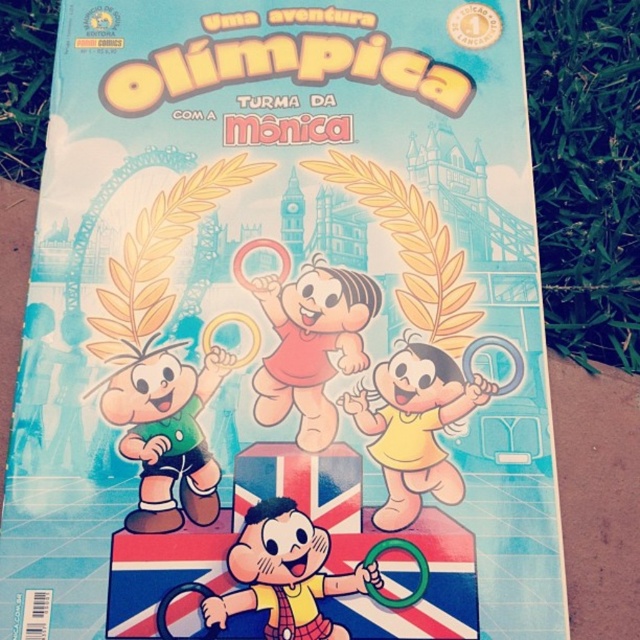
Question: Does matte orange ring at center have a smaller size compared to green grass at upper left?

Choices:
 (A) no
 (B) yes

Answer: (B)

Question: Which object is farther from the camera taking this photo?

Choices:
 (A) yellow matte figure at center
 (B) green matte shorts at lower left

Answer: (B)

Question: Based on their relative distances, which object is farther from the yellow matte figure at center?

Choices:
 (A) yellow matte plush toy at center
 (B) green grass at right

Answer: (B)

Question: Is matte orange ring at center to the left of yellow matte plush toy at center from the viewer's perspective?

Choices:
 (A) yes
 (B) no

Answer: (B)

Question: Considering the real-world distances, which object is farthest from the green matte shorts at lower left?

Choices:
 (A) yellow matte plush toy at center
 (B) matte orange ring at center
 (C) yellow matte figure at center
 (D) green grass at upper left

Answer: (D)

Question: Is matte orange ring at center bigger than green grass at upper left?

Choices:
 (A) yes
 (B) no

Answer: (B)